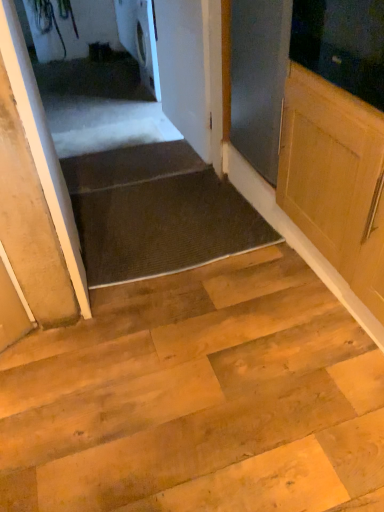
Locate an element on the screen. blank space above dark brown carpet at lower center (from a real-world perspective) is located at coordinates (139, 154).